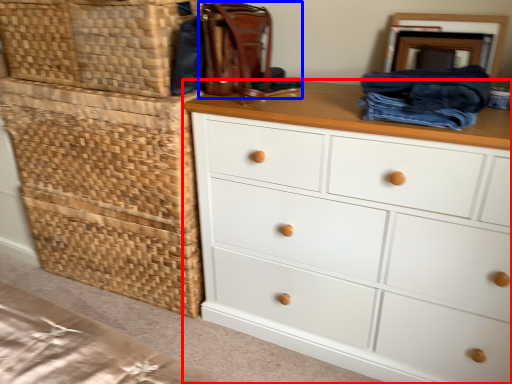
Question: Which object is closer to the camera taking this photo, chest of drawers (highlighted by a red box) or handbag (highlighted by a blue box)?

Choices:
 (A) chest of drawers
 (B) handbag

Answer: (A)